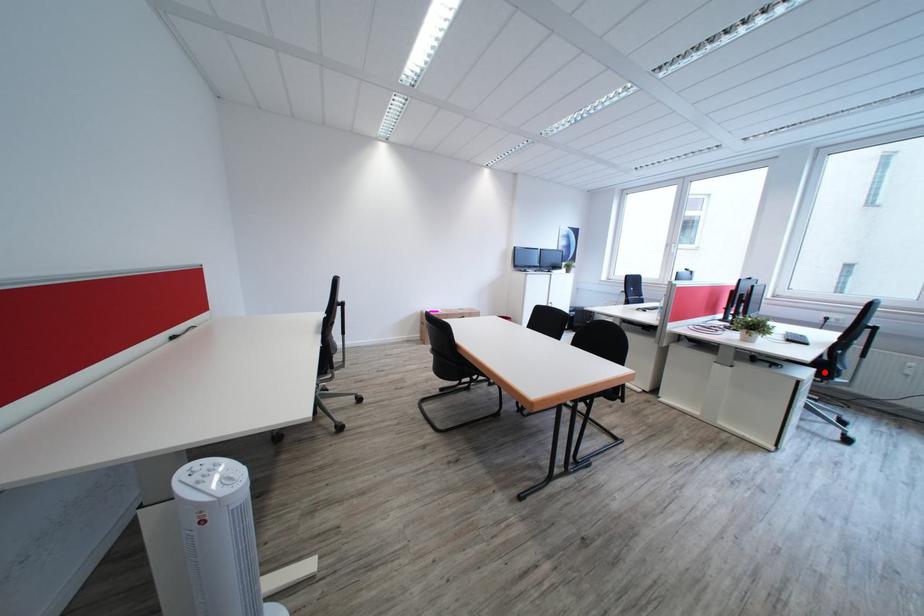
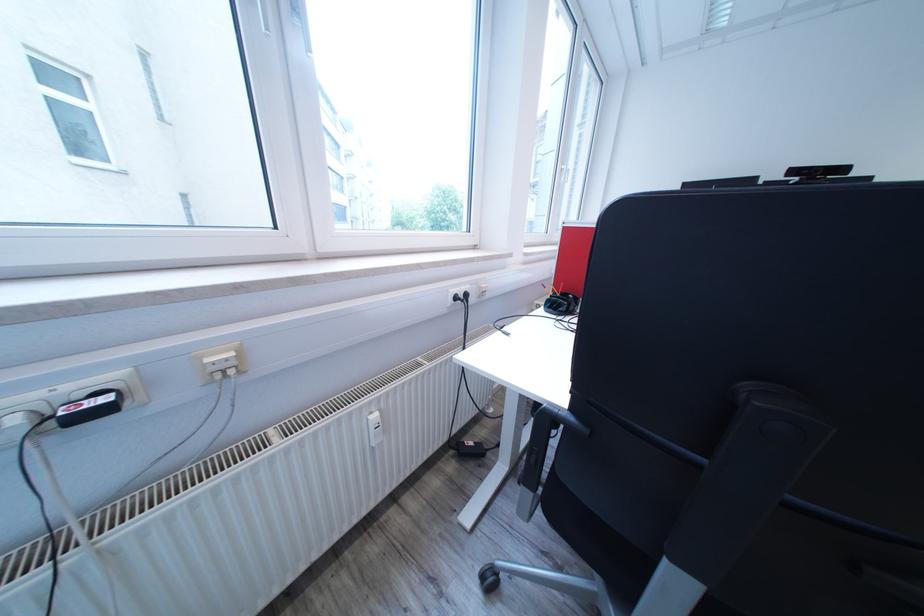
Question: I am providing you with two images of the same scene from different viewpoints. A red point is marked on the first image. Can you still see the location of the red point in image 2?

Choices:
 (A) Yes
 (B) No

Answer: (B)